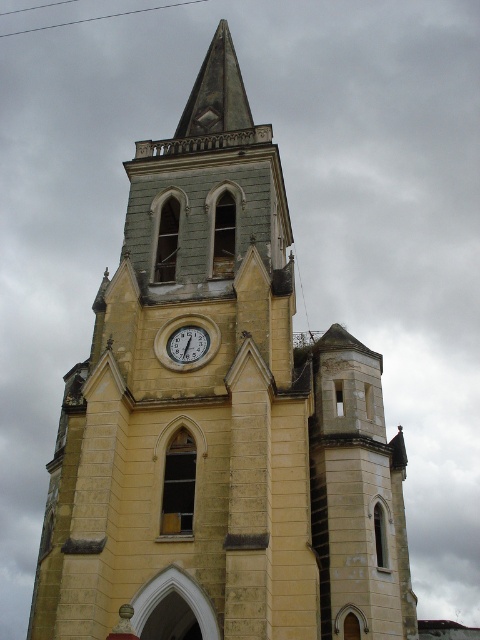
Question: Which point is closer to the camera?

Choices:
 (A) white glossy clock at center
 (B) matte white clock at center

Answer: (A)

Question: Among these points, which one is nearest to the camera?

Choices:
 (A) (168, 365)
 (B) (186, 349)

Answer: (A)

Question: Among these objects, which one is nearest to the camera?

Choices:
 (A) white glossy clock at center
 (B) matte white clock at center

Answer: (A)

Question: Does white glossy clock at center appear under matte white clock at center?

Choices:
 (A) yes
 (B) no

Answer: (B)

Question: Is white glossy clock at center to the left of matte white clock at center from the viewer's perspective?

Choices:
 (A) yes
 (B) no

Answer: (B)

Question: Can you confirm if white glossy clock at center is positioned below matte white clock at center?

Choices:
 (A) yes
 (B) no

Answer: (B)